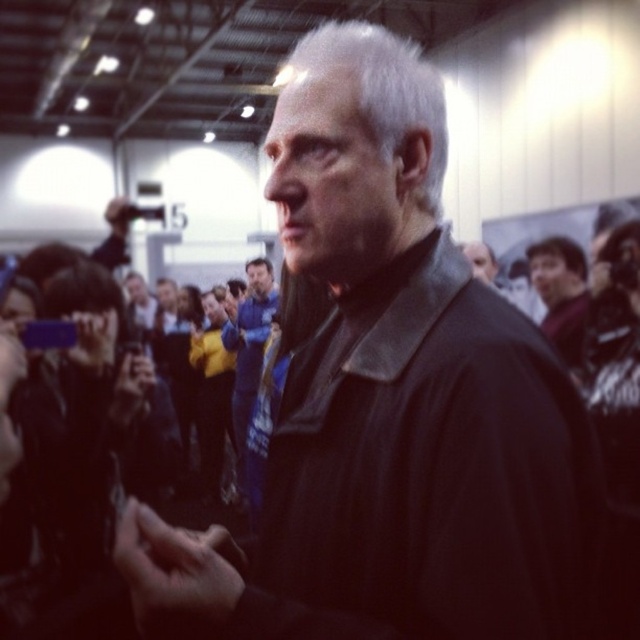
Question: Among these points, which one is farthest from the camera?

Choices:
 (A) (262, 304)
 (B) (566, 253)
 (C) (371, 109)

Answer: (B)

Question: Can you confirm if white matte hair at center is wider than blue fabric shirt at center?

Choices:
 (A) yes
 (B) no

Answer: (B)

Question: Considering the real-world distances, which object is closest to the dark blue shirt at right?

Choices:
 (A) white matte hair at center
 (B) blue fabric shirt at center

Answer: (B)

Question: Which point appears farthest from the camera in this image?

Choices:
 (A) (381, 106)
 (B) (252, 298)
 (C) (541, 321)

Answer: (B)

Question: Is white matte hair at center in front of dark blue shirt at right?

Choices:
 (A) yes
 (B) no

Answer: (A)

Question: Does white matte hair at center have a greater width compared to dark blue shirt at right?

Choices:
 (A) no
 (B) yes

Answer: (A)